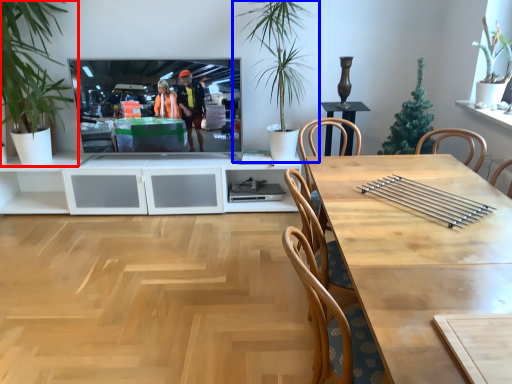
Question: Which point is closer to the camera, houseplant (highlighted by a red box) or houseplant (highlighted by a blue box)?

Choices:
 (A) houseplant
 (B) houseplant

Answer: (A)